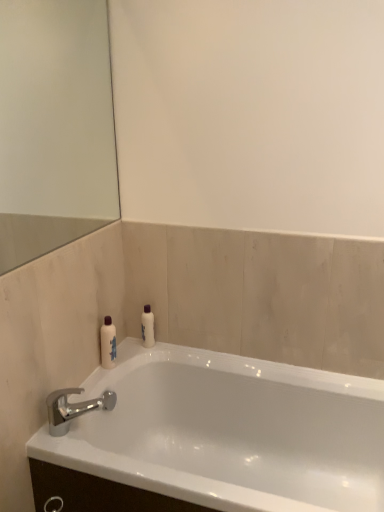
Locate an element on the screen. The width and height of the screenshot is (384, 512). free spot to the right of white glossy bottle at upper center, which ranks as the 2th toiletry in left-to-right order is located at coordinates (173, 350).